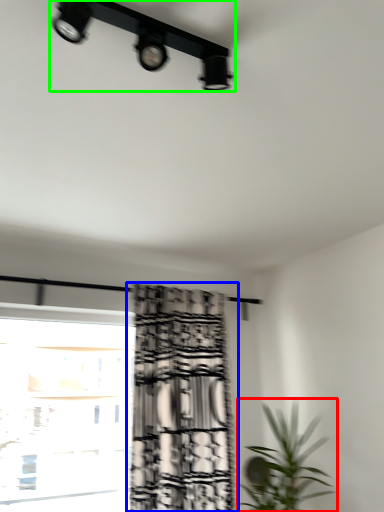
Question: Which object is positioned closest to houseplant (highlighted by a red box)? Select from curtain (highlighted by a blue box) and lamp (highlighted by a green box).

Choices:
 (A) curtain
 (B) lamp

Answer: (A)